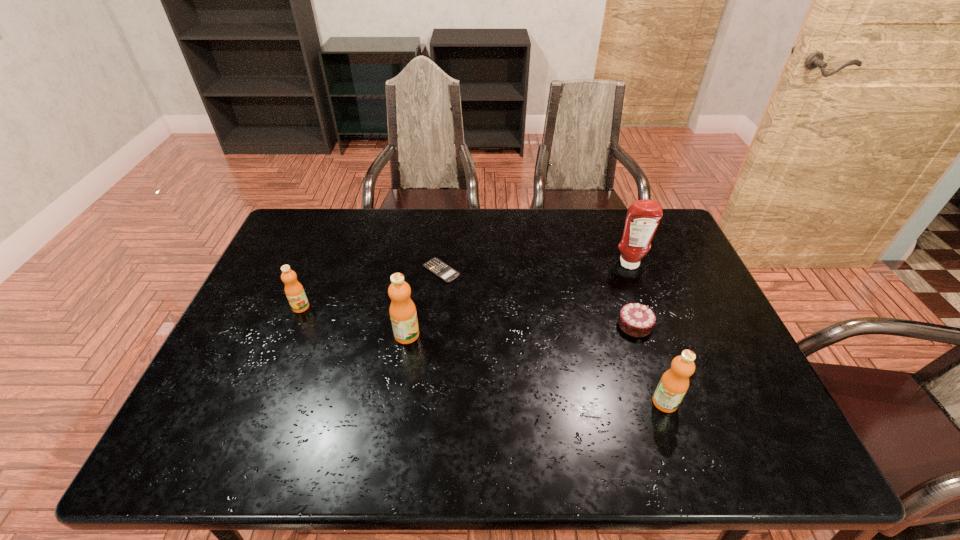
Locate an element on the screen. vacant space situated on the front label of the third tallest object is located at coordinates (703, 402).

The image size is (960, 540). In order to click on vacant region located on the left of the second shortest object in this screenshot , I will do `click(522, 325)`.

Find the location of a particular element. Image resolution: width=960 pixels, height=540 pixels. free space located on the back of the condiment is located at coordinates (612, 220).

This screenshot has height=540, width=960. What are the coordinates of `free space located 0.170m on the front of the shortest object` in the screenshot? It's located at (436, 327).

You are a GUI agent. You are given a task and a screenshot of the screen. Output one action in this format:
    pyautogui.click(x=<x>, y=<y>)
    Task: Click on the object situated at the near edge
    This screenshot has height=540, width=960.
    Given the screenshot: What is the action you would take?
    pyautogui.click(x=674, y=383)

Find the location of a particular element. object that is at the left edge is located at coordinates (294, 291).

Where is `object at the right edge`? The height and width of the screenshot is (540, 960). object at the right edge is located at coordinates (643, 216).

In the image, there is a desktop. Identify the location of vacant region at the far edge. Image resolution: width=960 pixels, height=540 pixels. (368, 244).

In the image, there is a desktop. Where is `free region at the near edge`? The width and height of the screenshot is (960, 540). free region at the near edge is located at coordinates (285, 387).

Where is `vacant region at the left edge`? This screenshot has width=960, height=540. vacant region at the left edge is located at coordinates (309, 280).